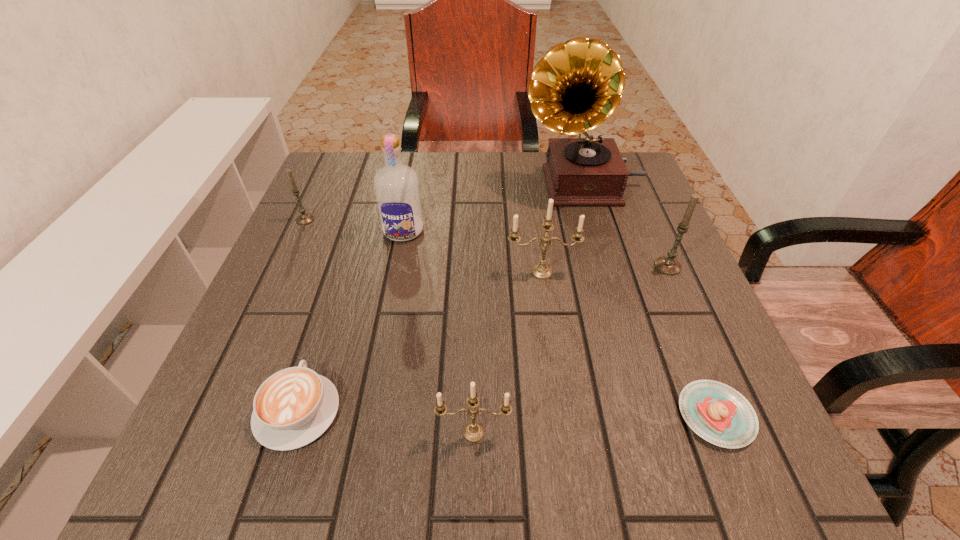
Where is `the tallest object`? The image size is (960, 540). the tallest object is located at coordinates (577, 85).

You are a GUI agent. You are given a task and a screenshot of the screen. Output one action in this format:
    pyautogui.click(x=<x>, y=<y>)
    Task: Click on the brown phonograph record
    
    Given the screenshot: What is the action you would take?
    pyautogui.click(x=577, y=85)

Find the location of `vodka`. vodka is located at coordinates (396, 186).

Where is `the second tallest object`? the second tallest object is located at coordinates (396, 186).

Locate an element on the screen. The width and height of the screenshot is (960, 540). the rightmost candle is located at coordinates (668, 265).

This screenshot has width=960, height=540. Find the location of `the right gray candle`. the right gray candle is located at coordinates (668, 265).

Find the location of `the bigger metallic candle`. the bigger metallic candle is located at coordinates (541, 271).

At what (x,y) coordinates should I click in order to perform the action: click on the right metallic candle. Please return your answer as a coordinate pair (x, y). This screenshot has width=960, height=540. Looking at the image, I should click on (541, 271).

Where is `the left gray candle`? The height and width of the screenshot is (540, 960). the left gray candle is located at coordinates (305, 218).

This screenshot has height=540, width=960. Identify the location of the smaller gray candle. (305, 218).